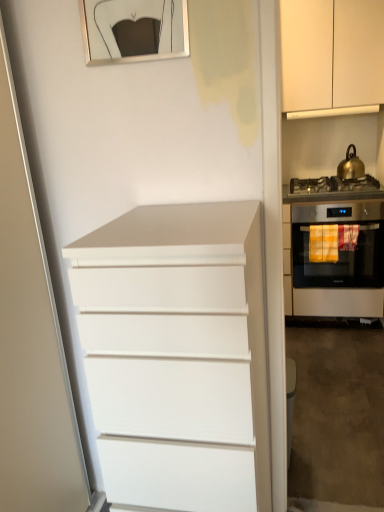
Question: Is white matte chest of drawers at center to the right of metallic gold picture frame at upper center from the viewer's perspective?

Choices:
 (A) no
 (B) yes

Answer: (B)

Question: From the image's perspective, does white matte chest of drawers at center appear lower than metallic gold picture frame at upper center?

Choices:
 (A) no
 (B) yes

Answer: (B)

Question: From the image's perspective, is white matte chest of drawers at center on metallic gold picture frame at upper center?

Choices:
 (A) yes
 (B) no

Answer: (B)

Question: Is white matte chest of drawers at center looking in the opposite direction of metallic gold picture frame at upper center?

Choices:
 (A) yes
 (B) no

Answer: (B)

Question: From a real-world perspective, is white matte chest of drawers at center under metallic gold picture frame at upper center?

Choices:
 (A) no
 (B) yes

Answer: (B)

Question: Which is correct: satin silver gas stove at right is inside metallic gold picture frame at upper center, or outside of it?

Choices:
 (A) inside
 (B) outside

Answer: (B)

Question: In terms of width, does satin silver gas stove at right look wider or thinner when compared to metallic gold picture frame at upper center?

Choices:
 (A) thin
 (B) wide

Answer: (B)

Question: From the image's perspective, is satin silver gas stove at right above or below metallic gold picture frame at upper center?

Choices:
 (A) above
 (B) below

Answer: (B)

Question: Considering the positions of point (332, 178) and point (97, 5), is point (332, 178) closer or farther from the camera than point (97, 5)?

Choices:
 (A) farther
 (B) closer

Answer: (A)

Question: Visually, is white matte chest of drawers at center positioned to the left or to the right of metallic gold picture frame at upper center?

Choices:
 (A) right
 (B) left

Answer: (A)

Question: In terms of height, does white matte chest of drawers at center look taller or shorter compared to metallic gold picture frame at upper center?

Choices:
 (A) tall
 (B) short

Answer: (A)

Question: From a real-world perspective, relative to metallic gold picture frame at upper center, is white matte chest of drawers at center vertically above or below?

Choices:
 (A) below
 (B) above

Answer: (A)

Question: Considering the positions of white matte chest of drawers at center and metallic gold picture frame at upper center in the image, is white matte chest of drawers at center bigger or smaller than metallic gold picture frame at upper center?

Choices:
 (A) big
 (B) small

Answer: (A)

Question: Is white matte chest of drawers at center situated inside satin stainless steel oven at right or outside?

Choices:
 (A) outside
 (B) inside

Answer: (A)

Question: In terms of height, does white matte chest of drawers at center look taller or shorter compared to satin stainless steel oven at right?

Choices:
 (A) tall
 (B) short

Answer: (A)